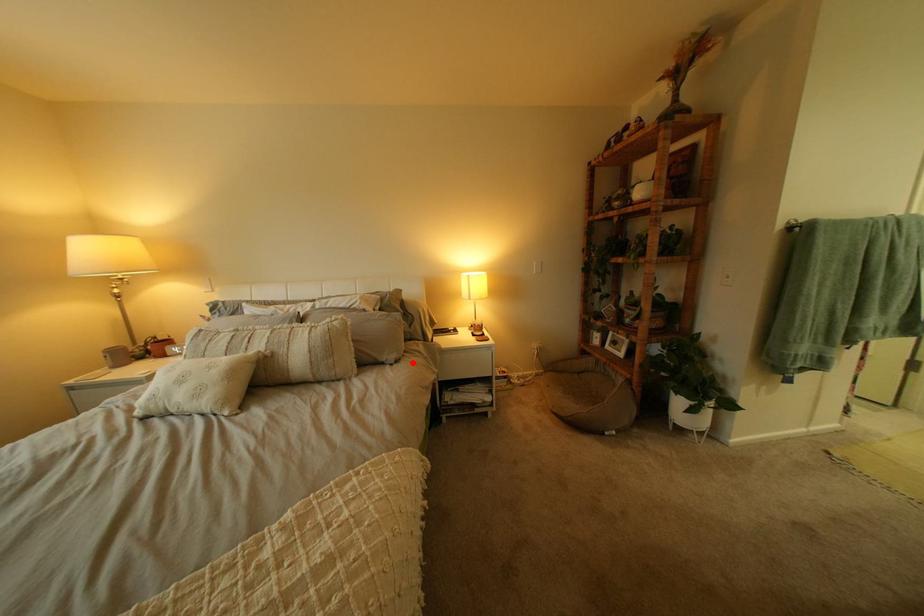
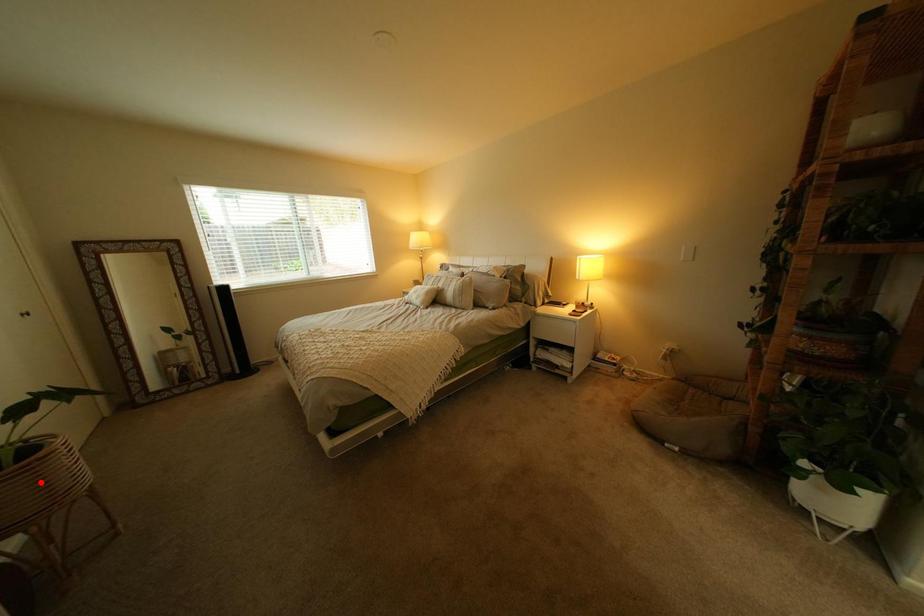
I am providing you with two images of the same scene from different viewpoints. A red point is marked on the first image and another point is marked on the second image. Is the red point in image1 aligned with the point shown in image2?

No